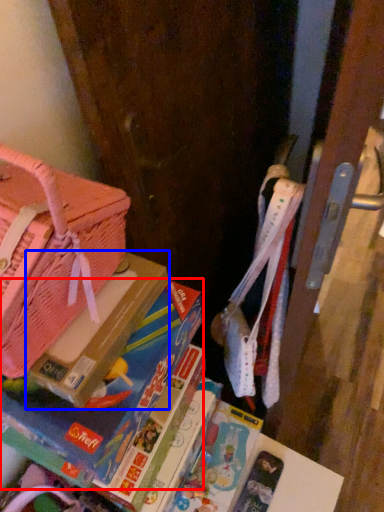
Question: Which point is further to the camera, book (highlighted by a red box) or paperback book (highlighted by a blue box)?

Choices:
 (A) book
 (B) paperback book

Answer: (B)